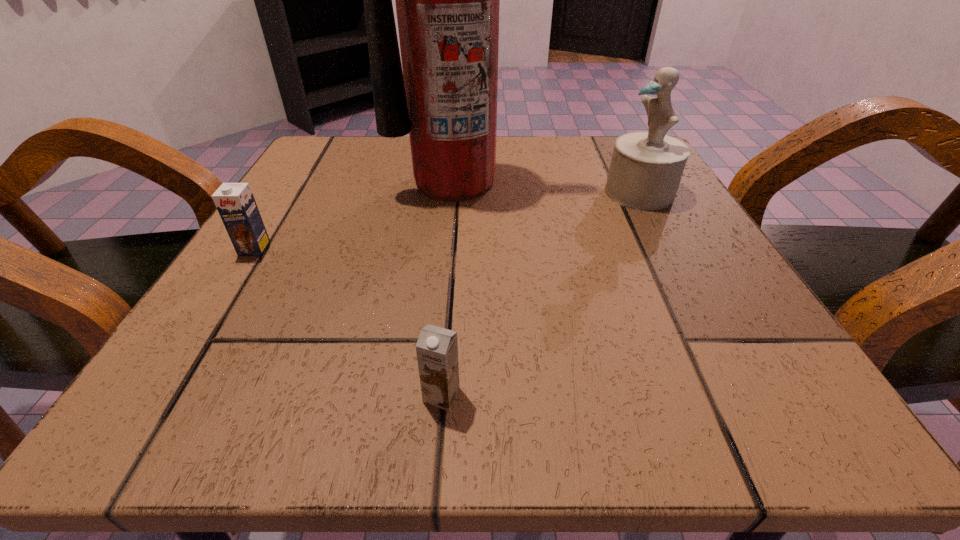
Where is `vacant position located at the beak of the third shortest object`? This screenshot has height=540, width=960. vacant position located at the beak of the third shortest object is located at coordinates (545, 192).

Where is `free space located on the front label of the left chocolate milk`? Image resolution: width=960 pixels, height=540 pixels. free space located on the front label of the left chocolate milk is located at coordinates (165, 390).

The height and width of the screenshot is (540, 960). In order to click on vacant position located on the back of the nearer chocolate milk in this screenshot , I will do `click(455, 218)`.

Locate an element on the screen. This screenshot has height=540, width=960. fire extinguisher located at the far edge is located at coordinates (447, 0).

This screenshot has width=960, height=540. I want to click on figurine situated at the far edge, so click(646, 168).

This screenshot has width=960, height=540. Find the location of `object situated at the near edge`. object situated at the near edge is located at coordinates (437, 348).

This screenshot has width=960, height=540. Identify the location of object located at the left edge. (235, 202).

The image size is (960, 540). In order to click on object located at the right edge in this screenshot , I will do `click(646, 168)`.

Image resolution: width=960 pixels, height=540 pixels. Find the location of `object positioned at the far right corner`. object positioned at the far right corner is located at coordinates (646, 168).

Image resolution: width=960 pixels, height=540 pixels. I want to click on free region at the far edge of the desktop, so click(x=541, y=158).